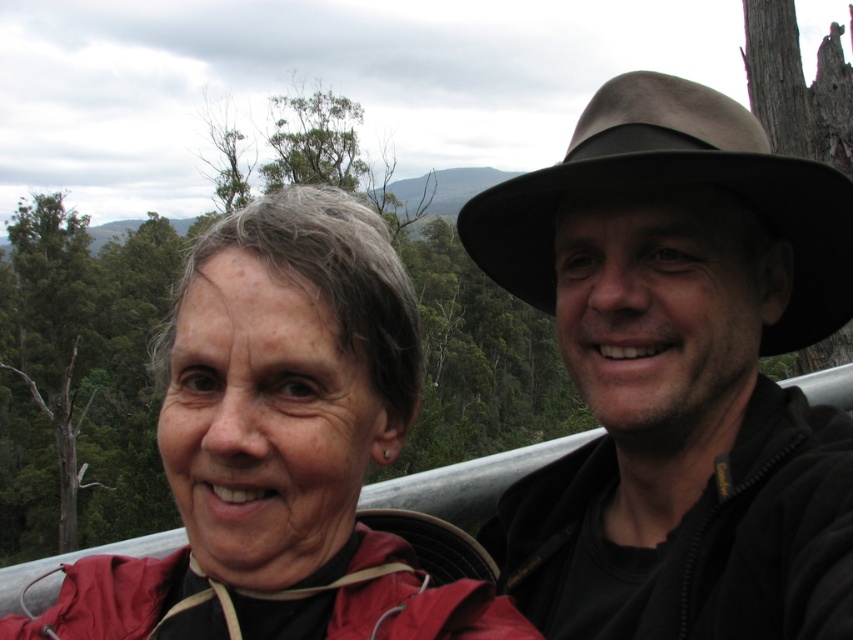
You are a photographer trying to capture both the matte red jacket at left and the brown felt cowboy hat at upper right in a single frame. Given their sizes, which object should you focus on to ensure both fit clearly in the photo?

The matte red jacket at left is smaller than the brown felt cowboy hat at upper right, so focusing on the brown felt cowboy hat at upper right would allow both objects to fit clearly in the photo since it takes up more space.

You are a photographer taking a picture of the matte red jacket at left and the brown felt cowboy hat at upper right. Which object is positioned higher in the image?

The brown felt cowboy hat at upper right is positioned higher in the image than the matte red jacket at left.